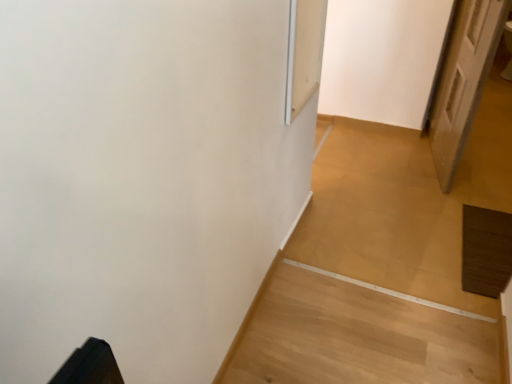
Locate an element on the screen. vacant area to the left of white wooden door at right is located at coordinates (376, 162).